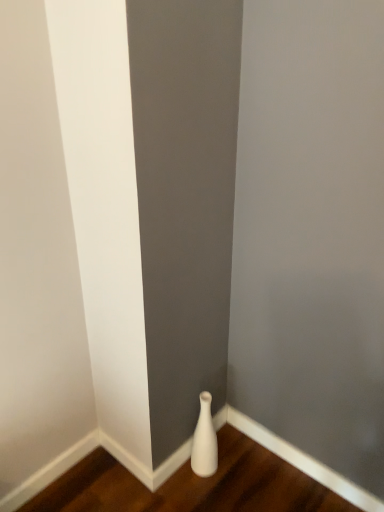
At what (x,y) coordinates should I click in order to perform the action: click on vacant area in front of white matte vase at lower right. Please return your answer as a coordinate pair (x, y). The height and width of the screenshot is (512, 384). Looking at the image, I should click on (208, 494).